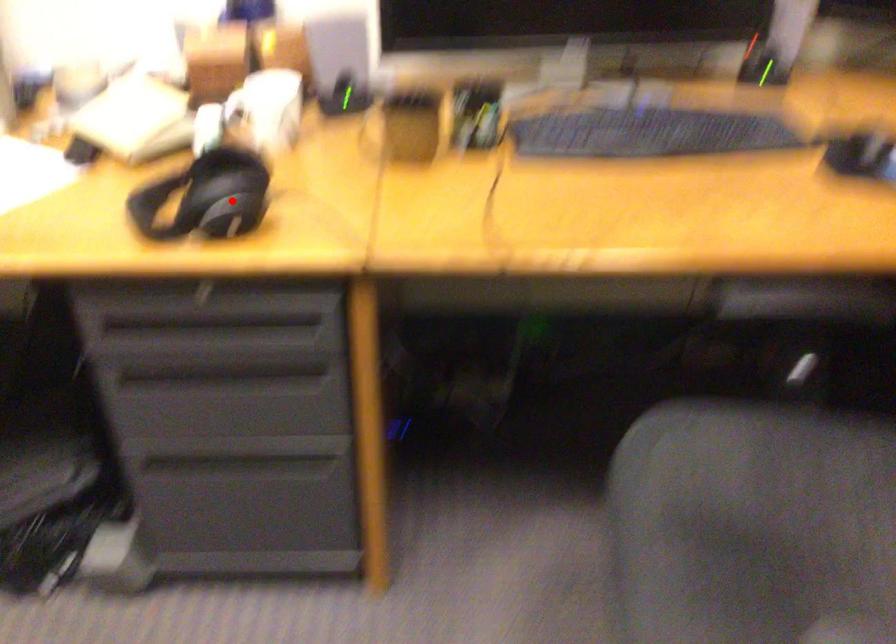
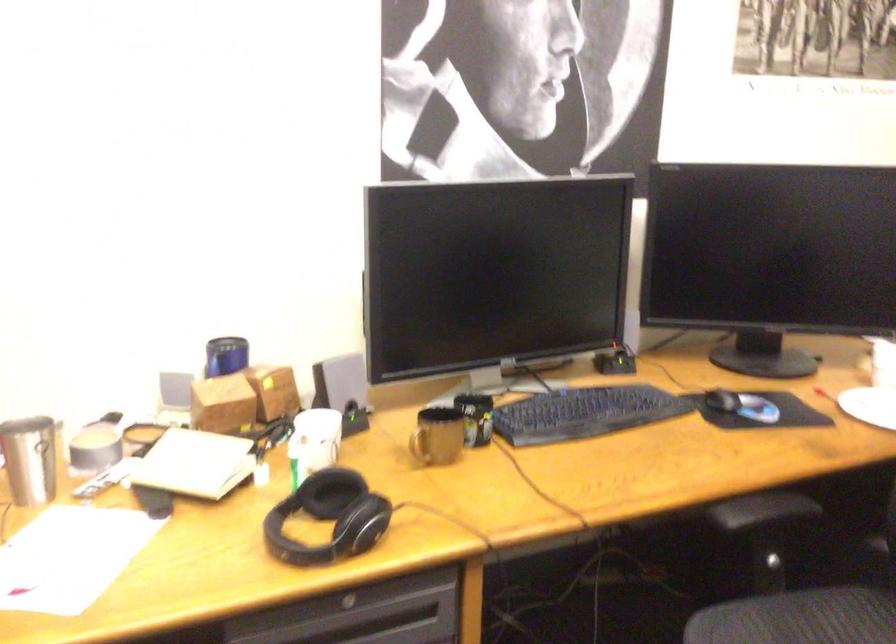
In the second image, find the point that corresponds to the highlighted location in the first image.

(329, 518)